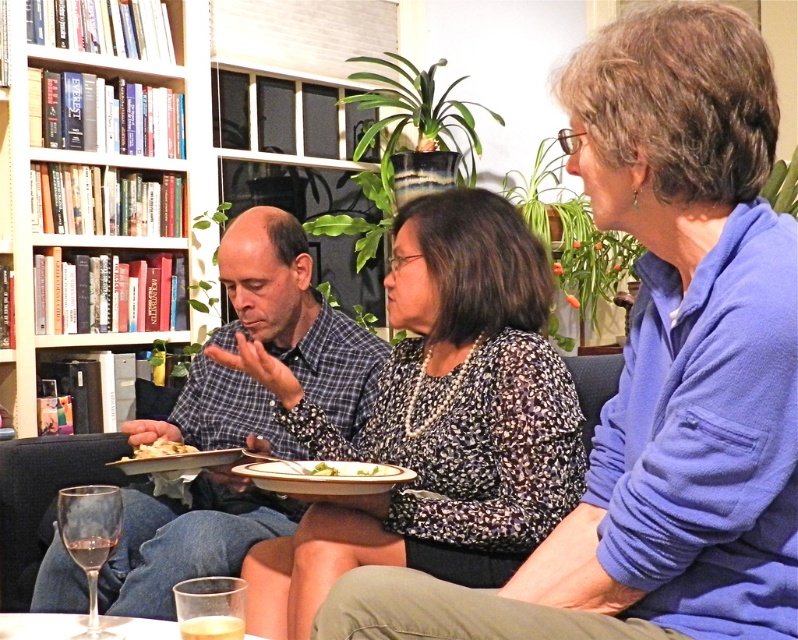
Question: Which object appears closest to the camera in this image?

Choices:
 (A) white wooden bookcase at upper left
 (B) clear glass wine glass at lower left

Answer: (B)

Question: Is patterned fabric blouse at center to the right of white matte plate at center from the viewer's perspective?

Choices:
 (A) no
 (B) yes

Answer: (B)

Question: Does patterned fabric blouse at center appear under plaid shirt at center?

Choices:
 (A) no
 (B) yes

Answer: (A)

Question: Estimate the real-world distances between objects in this image. Which object is closer to the white wooden bookcase at upper left?

Choices:
 (A) patterned fabric blouse at center
 (B) green leafy salad at center

Answer: (A)

Question: Observing the image, what is the correct spatial positioning of green leafy salad at center in reference to white matte plate at center?

Choices:
 (A) right
 (B) left

Answer: (A)

Question: Which of the following is the closest to the observer?

Choices:
 (A) dark blue fabric couch at center
 (B) patterned fabric blouse at center
 (C) plaid shirt at center

Answer: (B)